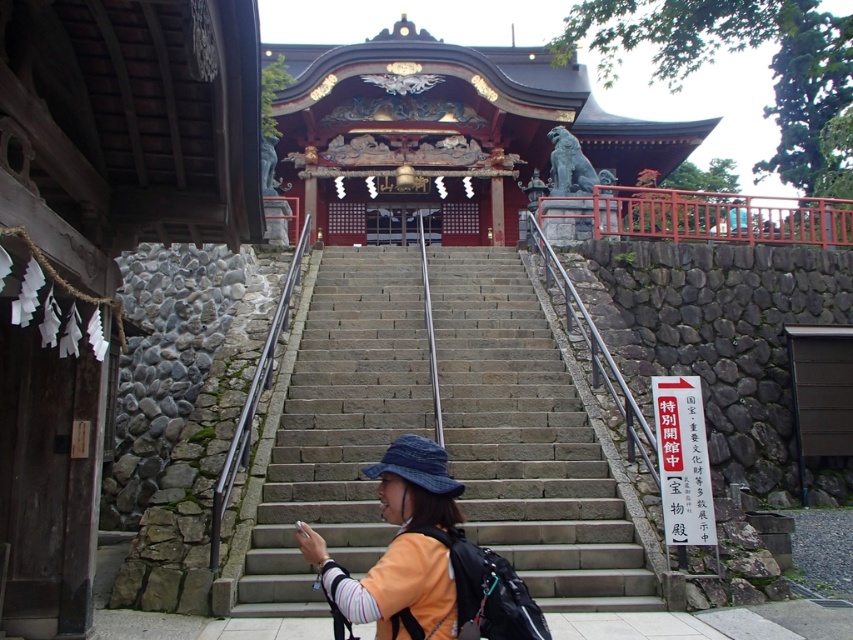
Between gray stone stairs at center and orange fabric jacket at center, which one has more height?

Standing taller between the two is gray stone stairs at center.

Which is below, gray stone stairs at center or orange fabric jacket at center?

Positioned lower is orange fabric jacket at center.

Find the location of a particular element. This screenshot has height=640, width=853. gray stone stairs at center is located at coordinates [527, 442].